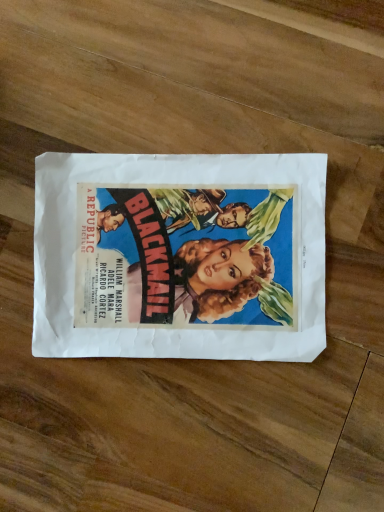
This screenshot has width=384, height=512. I want to click on free spot above matte paper poster at center (from a real-world perspective), so point(178,255).